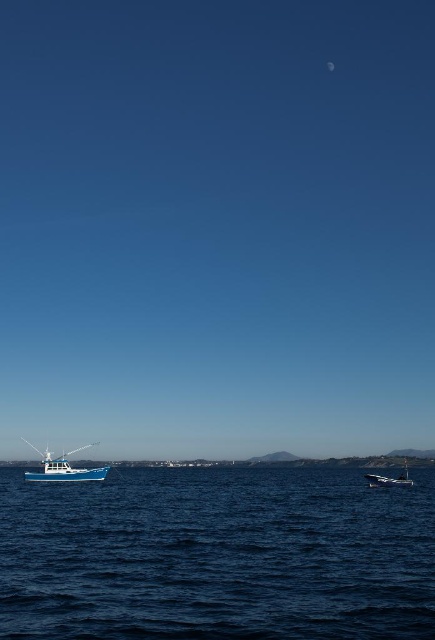
Imagine you are a drone operator who needs to locate the blue matte fishing boat at lower left in the image. According to the coordinates provided, where exactly should you direct your drone to find it?

The blue matte fishing boat at lower left is located at coordinates point (63, 468). Direct the drone to that point to locate it.

You are standing on the shore looking at the seascape. The blue water at lower left and the shiny blue boat at lower right are both visible. Which object appears taller in the image?

The shiny blue boat at lower right appears taller than the blue water at lower left according to the description.

Looking at this image, you are standing on the beach and see the blue matte fishing boat at lower left and the shiny blue boat at lower right. If you want to walk to the closest boat, which one should you head towards?

The blue matte fishing boat at lower left is 70.29 meters away from the shiny blue boat at lower right. Since you are on the beach, the distance to each boat depends on your position. However, without knowing your exact location, it is impossible to determine which boat is closer to you.